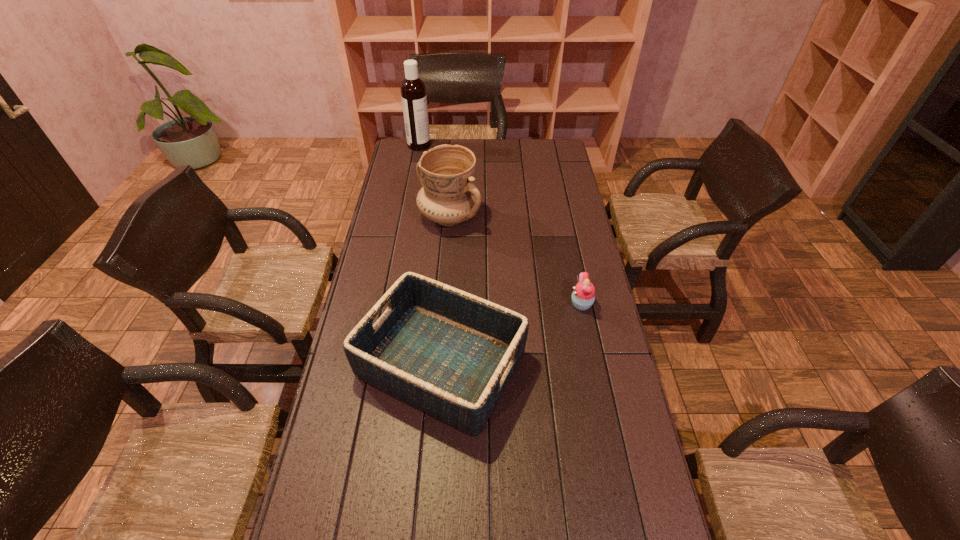
Locate an element on the screen. The width and height of the screenshot is (960, 540). vacant area at the right edge is located at coordinates (556, 167).

The height and width of the screenshot is (540, 960). Identify the location of vacant space at the far left corner of the desktop. (430, 143).

In the image, there is a desktop. Where is `blank space at the far right corner`? blank space at the far right corner is located at coordinates (535, 144).

Locate an element on the screen. empty space between the basket and the farthest object is located at coordinates (430, 254).

I want to click on vacant area that lies between the basket and the dishwasher detergent, so click(430, 254).

In order to click on vacant region between the tallest object and the rightmost object in this screenshot , I will do `click(500, 225)`.

At what (x,y) coordinates should I click in order to perform the action: click on empty space that is in between the rightmost object and the second tallest object. Please return your answer as a coordinate pair (x, y). This screenshot has width=960, height=540. Looking at the image, I should click on (516, 260).

Locate an element on the screen. The width and height of the screenshot is (960, 540). free space between the dishwasher detergent and the basket is located at coordinates (430, 254).

Image resolution: width=960 pixels, height=540 pixels. I want to click on the second closest object to the pottery, so click(413, 90).

This screenshot has height=540, width=960. I want to click on the closest object relative to the tallest object, so click(449, 197).